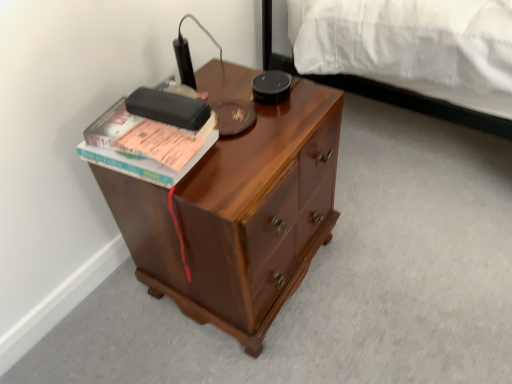
Question: Should I look upward or downward to see hardcover book at upper left?

Choices:
 (A) down
 (B) up

Answer: (B)

Question: Is the position of hardcover book at upper left less distant than that of shiny brown wooden desk at center?

Choices:
 (A) no
 (B) yes

Answer: (A)

Question: Can you confirm if hardcover book at upper left is positioned to the left of shiny brown wooden desk at center?

Choices:
 (A) yes
 (B) no

Answer: (A)

Question: From a real-world perspective, is hardcover book at upper left beneath shiny brown wooden desk at center?

Choices:
 (A) yes
 (B) no

Answer: (B)

Question: Is hardcover book at upper left oriented towards shiny brown wooden desk at center?

Choices:
 (A) yes
 (B) no

Answer: (B)

Question: From the image's perspective, is hardcover book at upper left on top of shiny brown wooden desk at center?

Choices:
 (A) yes
 (B) no

Answer: (A)

Question: Does hardcover book at upper left have a lesser width compared to shiny brown wooden desk at center?

Choices:
 (A) yes
 (B) no

Answer: (A)

Question: Is there a large distance between shiny brown wooden desk at center and hardcover book at upper left?

Choices:
 (A) yes
 (B) no

Answer: (B)

Question: Does shiny brown wooden desk at center lie in front of hardcover book at upper left?

Choices:
 (A) no
 (B) yes

Answer: (B)

Question: Does shiny brown wooden desk at center appear on the right side of hardcover book at upper left?

Choices:
 (A) yes
 (B) no

Answer: (A)

Question: Can you confirm if shiny brown wooden desk at center is taller than hardcover book at upper left?

Choices:
 (A) no
 (B) yes

Answer: (B)

Question: Does shiny brown wooden desk at center have a smaller size compared to hardcover book at upper left?

Choices:
 (A) yes
 (B) no

Answer: (B)

Question: Is the depth of shiny brown wooden desk at center greater than that of hardcover book at upper left?

Choices:
 (A) yes
 (B) no

Answer: (B)

Question: Choose the correct answer: Is hardcover book at upper left inside shiny brown wooden desk at center or outside it?

Choices:
 (A) inside
 (B) outside

Answer: (B)